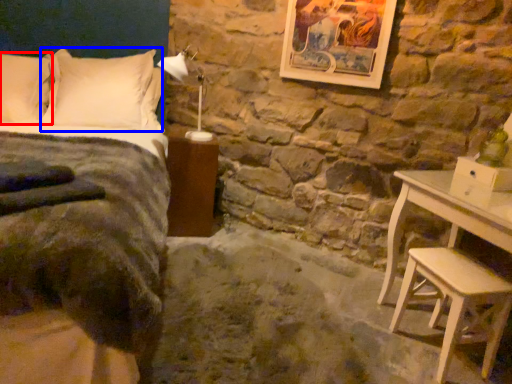
Question: Which of the following is the closest to the observer, pillow (highlighted by a red box) or pillow (highlighted by a blue box)?

Choices:
 (A) pillow
 (B) pillow

Answer: (A)